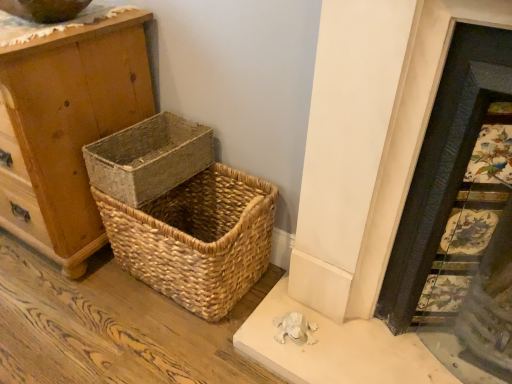
At what (x,y) coordinates should I click in order to perform the action: click on free space to the left of natural woven picnic basket at lower left, marked as the 1th picnic basket in a bottom-to-top arrangement. Please return your answer as a coordinate pair (x, y). This screenshot has width=512, height=384. Looking at the image, I should click on (70, 297).